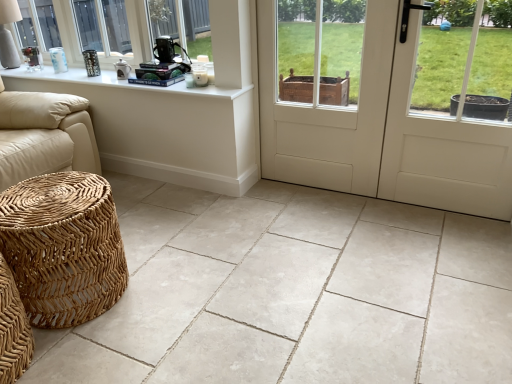
I want to click on matte white windowsill at upper left, so click(87, 27).

At what (x,y) coordinates should I click in order to perform the action: click on white matte door at center. Please return your answer as a coordinate pair (x, y). The image size is (512, 384). Looking at the image, I should click on (390, 100).

Locate an element on the screen. This screenshot has height=384, width=512. woven rattan stool at lower left is located at coordinates (164, 127).

Would you consider white matte door at center to be distant from matte white windowsill at upper left?

white matte door at center is positioned a significant distance from matte white windowsill at upper left.

Based on the photo, how much distance is there between white matte door at center and matte white windowsill at upper left?

white matte door at center is 5.11 feet from matte white windowsill at upper left.

Image resolution: width=512 pixels, height=384 pixels. Find the location of `window above the white matte door at center (from the image's perspective)`. window above the white matte door at center (from the image's perspective) is located at coordinates (87, 27).

Does white matte door at center have a greater width compared to matte white windowsill at upper left?

No, white matte door at center is not wider than matte white windowsill at upper left.

Is white ceramic table lamp at upper left inside woven natural basket at lower left?

No, white ceramic table lamp at upper left is not inside woven natural basket at lower left.

Are woven natural basket at lower left and white ceramic table lamp at upper left located far from each other?

Yes, woven natural basket at lower left and white ceramic table lamp at upper left are quite far apart.

Which of these two, woven natural basket at lower left or white ceramic table lamp at upper left, is wider?

woven natural basket at lower left is wider.

Which of these two, matte white windowsill at upper left or woven natural basket at lower left, stands taller?

woven natural basket at lower left is taller.

Considering the positions of objects matte white windowsill at upper left and woven natural basket at lower left in the image provided, who is more to the left, matte white windowsill at upper left or woven natural basket at lower left?

From the viewer's perspective, matte white windowsill at upper left appears more on the left side.

From a real-world perspective, which is physically below, matte white windowsill at upper left or woven natural basket at lower left?

woven natural basket at lower left.

In the scene shown: From the image's perspective, between white matte door at center and woven natural basket at lower left, which one is located above?

white matte door at center appears higher in the image.

How many degrees apart are the facing directions of white matte door at center and woven natural basket at lower left?

white matte door at center and woven natural basket at lower left are facing 90.2 degrees away from each other.

Does white matte door at center appear on the right side of woven natural basket at lower left?

Correct, you'll find white matte door at center to the right of woven natural basket at lower left.

How much distance is there between white matte door at center and woven natural basket at lower left?

They are 1.40 meters apart.

Is woven rattan stool at lower left bigger or smaller than white wood screen door at center?

Clearly, woven rattan stool at lower left is smaller in size than white wood screen door at center.

Looking at this image, from a real-world perspective, is woven rattan stool at lower left positioned over white wood screen door at center based on gravity?

Actually, woven rattan stool at lower left is physically below white wood screen door at center in the real world.

Is point (213, 141) positioned after point (384, 109)?

Yes.

In the image, is woven rattan stool at lower left on the left side or the right side of white wood screen door at center?

Clearly, woven rattan stool at lower left is on the left of white wood screen door at center in the image.

Find the location of a particular element. This screenshot has width=512, height=384. basket that is in front of the matte white windowsill at upper left is located at coordinates (63, 247).

From a real-world perspective, which object rests below the other?

From a 3D spatial view, woven natural basket at lower left is below.

Are woven natural basket at lower left and matte white windowsill at upper left making contact?

No, woven natural basket at lower left is not making contact with matte white windowsill at upper left.

Is woven natural basket at lower left completely or partially outside of matte white windowsill at upper left?

woven natural basket at lower left is positioned outside matte white windowsill at upper left.

Is there a large distance between natural stone tile at lower left and matte white windowsill at upper left?

natural stone tile at lower left is positioned a significant distance from matte white windowsill at upper left.

Considering the relative sizes of natural stone tile at lower left and matte white windowsill at upper left in the image provided, is natural stone tile at lower left taller than matte white windowsill at upper left?

In fact, natural stone tile at lower left may be shorter than matte white windowsill at upper left.

Find the location of a particular element. ceramic tile beneath the matte white windowsill at upper left (from a real-world perspective) is located at coordinates coord(293,293).

Do you think natural stone tile at lower left is within matte white windowsill at upper left, or outside of it?

natural stone tile at lower left lies outside matte white windowsill at upper left.

The height and width of the screenshot is (384, 512). What are the coordinates of `window that is above the white matte door at center (from a real-world perspective)` in the screenshot? It's located at (87, 27).

Locate an element on the screen. This screenshot has height=384, width=512. basket located in front of the white ceramic table lamp at upper left is located at coordinates (63, 247).

From the image, which object appears to be nearer to natural stone tile at lower left, woven natural basket at lower left or matte white windowsill at upper left?

woven natural basket at lower left.

Which object lies nearer to the anchor point white painted wood at upper left, woven natural basket at lower left or matte white windowsill at upper left?

The object closer to white painted wood at upper left is matte white windowsill at upper left.

Based on their spatial positions, is white painted wood at upper left or white matte door at center closer to matte white windowsill at upper left?

Based on the image, white painted wood at upper left appears to be nearer to matte white windowsill at upper left.

From the image, which object appears to be farther from matte white windowsill at upper left, white ceramic table lamp at upper left or woven rattan stool at lower left?

The object further to matte white windowsill at upper left is woven rattan stool at lower left.

Estimate the real-world distances between objects in this image. Which object is closer to woven natural basket at lower left, white ceramic table lamp at upper left or white wood screen door at center?

white wood screen door at center lies closer to woven natural basket at lower left than the other object.

Considering their positions, is white matte door at center positioned further to woven rattan stool at lower left than white ceramic table lamp at upper left?

The object further to woven rattan stool at lower left is white ceramic table lamp at upper left.

Considering their positions, is natural stone tile at lower left positioned further to woven rattan stool at lower left than white wood screen door at center?

natural stone tile at lower left is further to woven rattan stool at lower left.

Looking at the image, which one is located further to natural stone tile at lower left, white ceramic table lamp at upper left or white wood screen door at center?

Among the two, white ceramic table lamp at upper left is located further to natural stone tile at lower left.

This screenshot has width=512, height=384. What are the coordinates of `table between white ceramic table lamp at upper left and white matte door at center` in the screenshot? It's located at (164, 127).

What are the coordinates of `window sill between white ceramic table lamp at upper left and white wood screen door at center` in the screenshot? It's located at (119, 82).

At what (x,y) coordinates should I click in order to perform the action: click on table located between white painted wood at upper left and white matte door at center in the left-right direction. Please return your answer as a coordinate pair (x, y). The width and height of the screenshot is (512, 384). Looking at the image, I should click on (164, 127).

Where is `window located between natural stone tile at lower left and white ceramic table lamp at upper left in the depth direction`? The width and height of the screenshot is (512, 384). window located between natural stone tile at lower left and white ceramic table lamp at upper left in the depth direction is located at coordinates (87, 27).